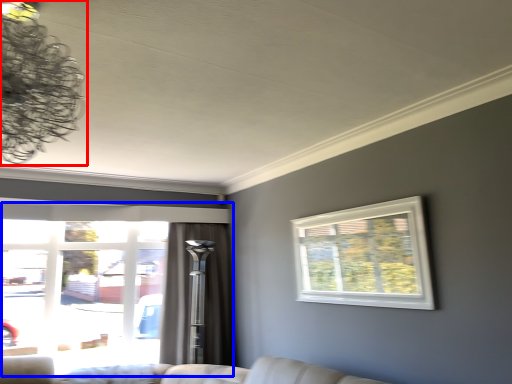
Question: Among these objects, which one is nearest to the camera, lamp (highlighted by a red box) or window (highlighted by a blue box)?

Choices:
 (A) lamp
 (B) window

Answer: (A)